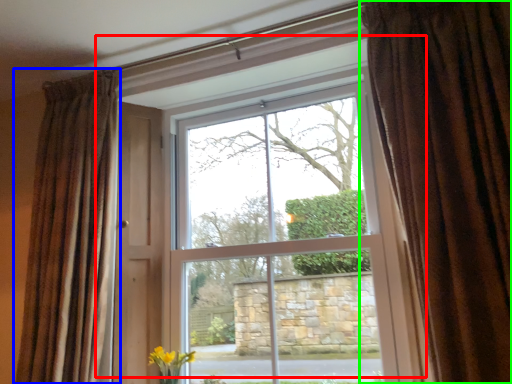
Question: Estimate the real-world distances between objects in this image. Which object is farther from window (highlighted by a red box), curtain (highlighted by a blue box) or curtain (highlighted by a green box)?

Choices:
 (A) curtain
 (B) curtain

Answer: (B)